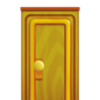
Find the location of a particular element. The width and height of the screenshot is (100, 100). brown frame design is located at coordinates (26, 19).